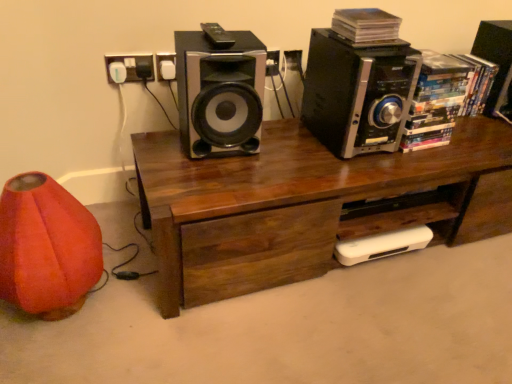
Where is `unoccupied region to the right of metallic silver speaker at center, which ranks as the 3th speaker in right-to-left order`? This screenshot has height=384, width=512. unoccupied region to the right of metallic silver speaker at center, which ranks as the 3th speaker in right-to-left order is located at coordinates (293, 155).